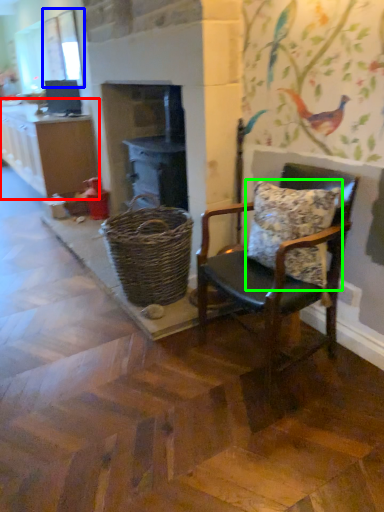
Question: Based on their relative distances, which object is nearer to cabinetry (highlighted by a red box)? Choose from window screen (highlighted by a blue box) and pillow (highlighted by a green box).

Choices:
 (A) window screen
 (B) pillow

Answer: (A)